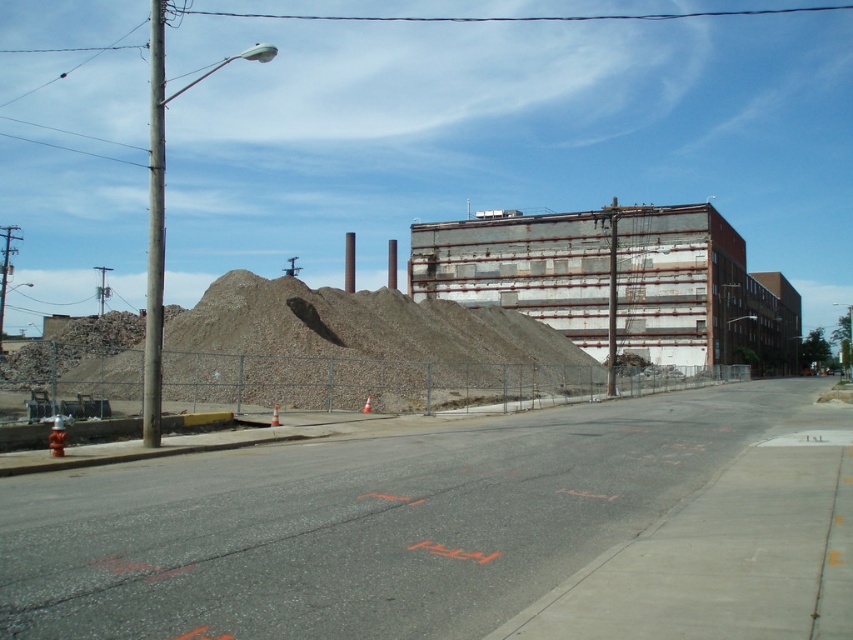
You are a construction worker who needs to move a large equipment that requires a flat and stable surface. Based on the scene, which area between the gray gravel pile at center and the rusty metal building at center would be more suitable for placing the equipment?

The rusty metal building at center is more suitable because the gray gravel pile at center occupies less space, implying it might be smaller and less stable compared to the larger area of the rusty metal building at center.

Based on the photo, you are a construction worker standing at the edge of the gray gravel pile at center. You need to move a heavy tool to the rusty metal building at center. Based on their positions, which direction should you move the tool to reach the building?

The gray gravel pile at center is below the rusty metal building at center, so you should move the tool upward to reach the rusty metal building at center.

You are a delivery driver who needs to park your truck near the gray gravel pile at center and the rusty metal building at center. Which object should you park closer to if you want to avoid blocking the entrance to the construction site?

You should park closer to the rusty metal building at center because the gray gravel pile at center is on its left side, so positioning near the building would keep the entrance clear.